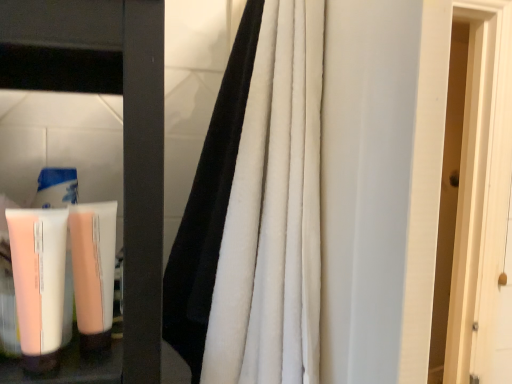
Question: Can you confirm if pink matte tube at lower left is wider than black velvet curtain at center?

Choices:
 (A) no
 (B) yes

Answer: (A)

Question: Considering the relative sizes of pink matte tube at lower left and black velvet curtain at center in the image provided, is pink matte tube at lower left shorter than black velvet curtain at center?

Choices:
 (A) yes
 (B) no

Answer: (A)

Question: Is pink matte tube at lower left oriented towards black velvet curtain at center?

Choices:
 (A) no
 (B) yes

Answer: (A)

Question: Can you confirm if pink matte tube at lower left is positioned to the right of black velvet curtain at center?

Choices:
 (A) no
 (B) yes

Answer: (A)

Question: Does pink matte tube at lower left come behind black velvet curtain at center?

Choices:
 (A) no
 (B) yes

Answer: (B)

Question: Considering the relative positions of pink matte tube at lower left and black velvet curtain at center in the image provided, is pink matte tube at lower left to the left of black velvet curtain at center from the viewer's perspective?

Choices:
 (A) yes
 (B) no

Answer: (A)

Question: Is pink matte tube at lower left further to the viewer compared to pale pink matte tube at lower left?

Choices:
 (A) yes
 (B) no

Answer: (B)

Question: Does pink matte tube at lower left have a smaller size compared to pale pink matte tube at lower left?

Choices:
 (A) no
 (B) yes

Answer: (A)

Question: From the image's perspective, is pink matte tube at lower left under pale pink matte tube at lower left?

Choices:
 (A) yes
 (B) no

Answer: (A)

Question: Considering the relative sizes of pink matte tube at lower left and pale pink matte tube at lower left in the image provided, is pink matte tube at lower left wider than pale pink matte tube at lower left?

Choices:
 (A) no
 (B) yes

Answer: (A)

Question: Would you say pink matte tube at lower left is a long distance from pale pink matte tube at lower left?

Choices:
 (A) yes
 (B) no

Answer: (B)

Question: Can you confirm if pink matte tube at lower left is bigger than pale pink matte tube at lower left?

Choices:
 (A) yes
 (B) no

Answer: (A)

Question: Could you tell me if black velvet curtain at center is facing pink matte tube at lower left?

Choices:
 (A) no
 (B) yes

Answer: (B)